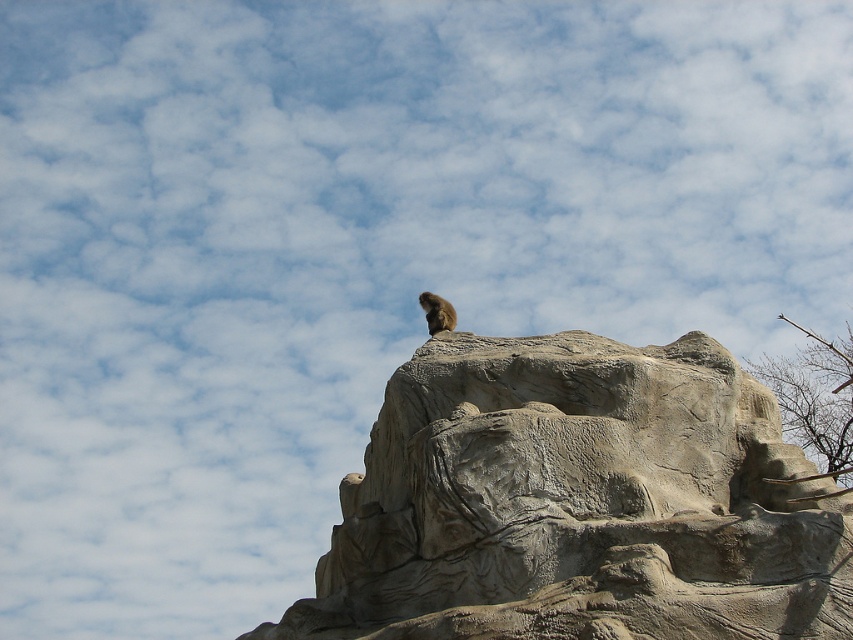
Question: Does gray stone rock at upper center come in front of furry brown animal at top?

Choices:
 (A) yes
 (B) no

Answer: (A)

Question: Which object is closer to the camera taking this photo?

Choices:
 (A) gray stone rock at upper center
 (B) brown bark tree at right
 (C) furry brown animal at top

Answer: (A)

Question: Based on their relative distances, which object is farther from the gray stone rock at upper center?

Choices:
 (A) brown bark tree at right
 (B) furry brown animal at top

Answer: (A)

Question: Is gray stone rock at upper center to the left of furry brown animal at top from the viewer's perspective?

Choices:
 (A) yes
 (B) no

Answer: (B)

Question: Is the position of gray stone rock at upper center more distant than that of brown bark tree at right?

Choices:
 (A) no
 (B) yes

Answer: (A)

Question: Which of the following is the farthest from the observer?

Choices:
 (A) (427, 305)
 (B) (843, 376)
 (C) (682, 428)

Answer: (B)